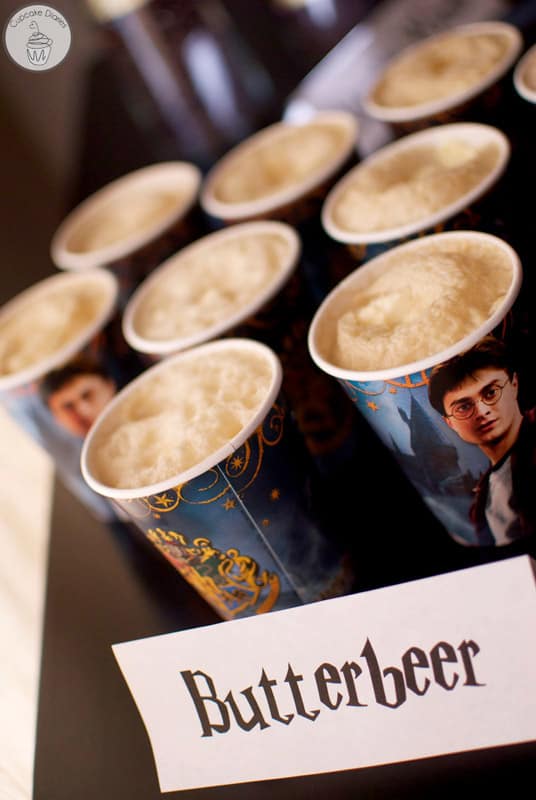
This screenshot has width=536, height=800. What are the coordinates of `table` in the screenshot? It's located at (59, 725).